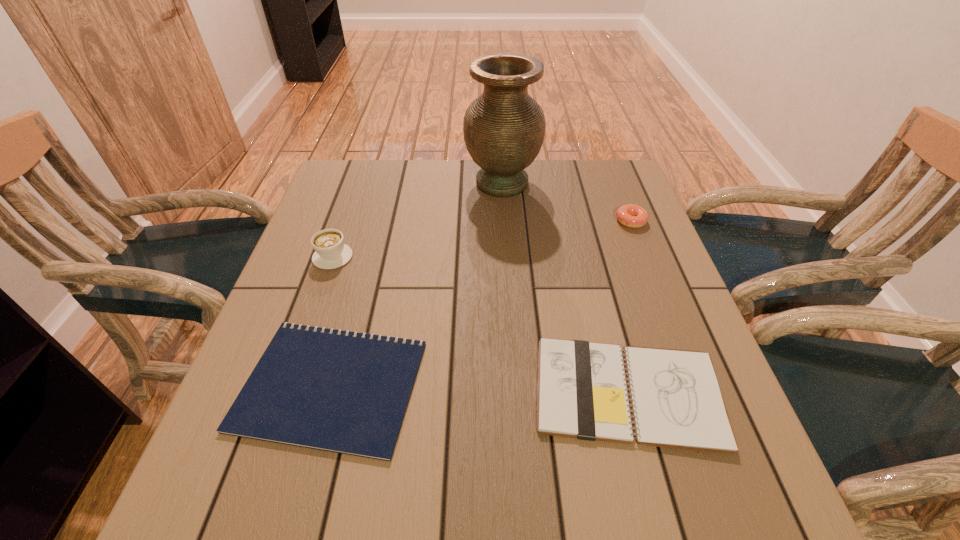
Where is `blank region between the shortest object and the farthest object`? Image resolution: width=960 pixels, height=540 pixels. blank region between the shortest object and the farthest object is located at coordinates (417, 284).

At what (x,y) coordinates should I click in order to perform the action: click on vacant region between the left notepad and the farthest object. Please return your answer as a coordinate pair (x, y). The height and width of the screenshot is (540, 960). Looking at the image, I should click on (417, 284).

This screenshot has width=960, height=540. Find the location of `free spot between the fourth nearest object and the vase`. free spot between the fourth nearest object and the vase is located at coordinates (566, 202).

Image resolution: width=960 pixels, height=540 pixels. Identify the location of free space between the taller notepad and the second farthest object. (629, 307).

At what (x,y) coordinates should I click in order to perform the action: click on vacant point located between the third shortest object and the left notepad. Please return your answer as a coordinate pair (x, y). The width and height of the screenshot is (960, 540). Looking at the image, I should click on (481, 303).

At what (x,y) coordinates should I click in order to perform the action: click on free spot between the second shortest object and the shortest object. Please return your answer as a coordinate pair (x, y). Looking at the image, I should click on (479, 389).

At what (x,y) coordinates should I click in order to perform the action: click on unoccupied area between the tallest object and the fourth nearest object. Please return your answer as a coordinate pair (x, y). Looking at the image, I should click on (566, 202).

Locate an element on the screen. The image size is (960, 540). free space between the third nearest object and the left notepad is located at coordinates (332, 321).

Identify the location of vacant point located between the fourth shortest object and the second farthest object. The image size is (960, 540). (482, 239).

Where is `unoccupied area between the fourth nearest object and the cappuccino`? The width and height of the screenshot is (960, 540). unoccupied area between the fourth nearest object and the cappuccino is located at coordinates pyautogui.click(x=482, y=239).